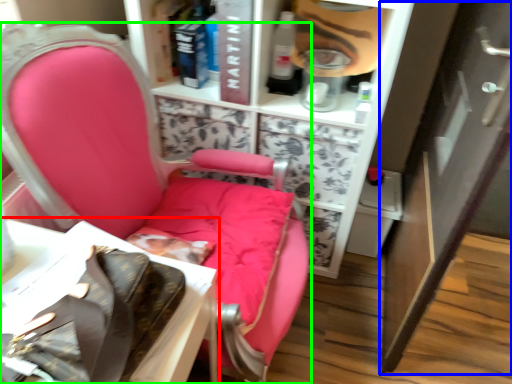
Question: Which object is the closest to the table (highlighted by a red box)? Choose among these: cabinetry (highlighted by a blue box) or chair (highlighted by a green box).

Choices:
 (A) cabinetry
 (B) chair

Answer: (B)